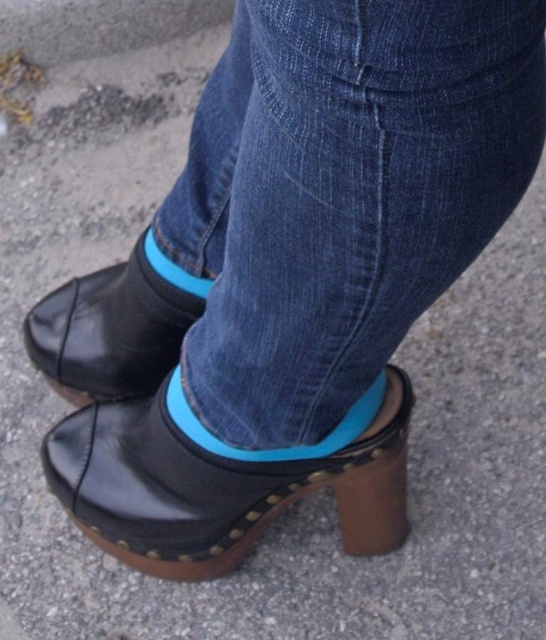
Which of these two, black leather clog at lower center or blue rubber sock at center, stands taller?

black leather clog at lower center

Between black leather clog at lower center and blue rubber sock at center, which one is positioned lower?

black leather clog at lower center is lower down.

Image resolution: width=546 pixels, height=640 pixels. What do you see at coordinates (216, 483) in the screenshot? I see `black leather clog at lower center` at bounding box center [216, 483].

Image resolution: width=546 pixels, height=640 pixels. I want to click on black leather clog at lower center, so click(216, 483).

Does black leather clog at lower center have a smaller size compared to black leather clog at center?

Incorrect, black leather clog at lower center is not smaller in size than black leather clog at center.

Does black leather clog at lower center have a greater width compared to black leather clog at center?

Yes, black leather clog at lower center is wider than black leather clog at center.

Locate an element on the screen. The width and height of the screenshot is (546, 640). black leather clog at lower center is located at coordinates (216, 483).

Does denim at center appear on the left side of black leather clog at center?

In fact, denim at center is to the right of black leather clog at center.

Which is behind, point (232, 115) or point (149, 380)?

Point (149, 380)

Looking at this image, measure the distance between point (x=314, y=289) and camera.

Point (x=314, y=289) is 22.20 inches away from camera.

Identify the location of denim at center. This screenshot has height=640, width=546. (342, 193).